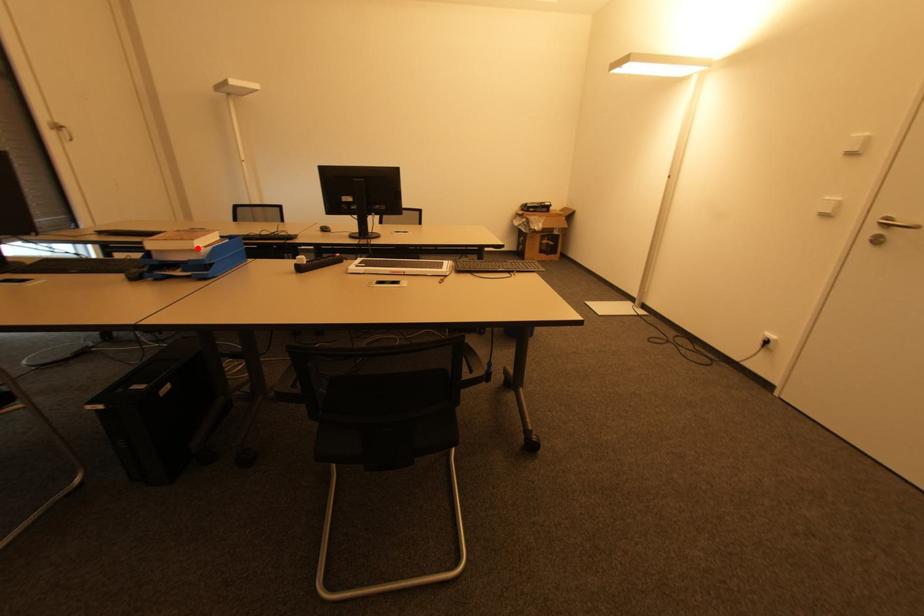
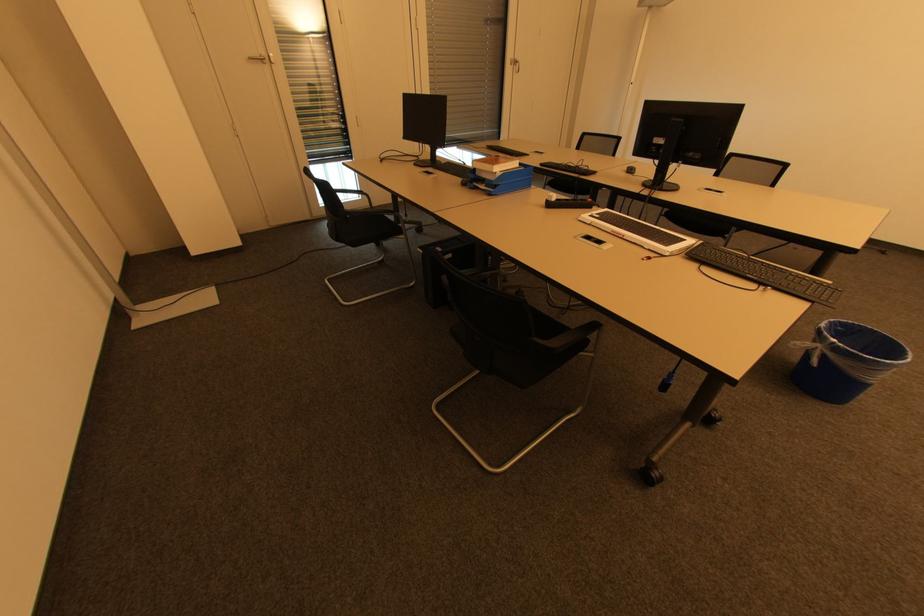
In the second image, find the point that corresponds to the highlighted location in the first image.

(495, 172)